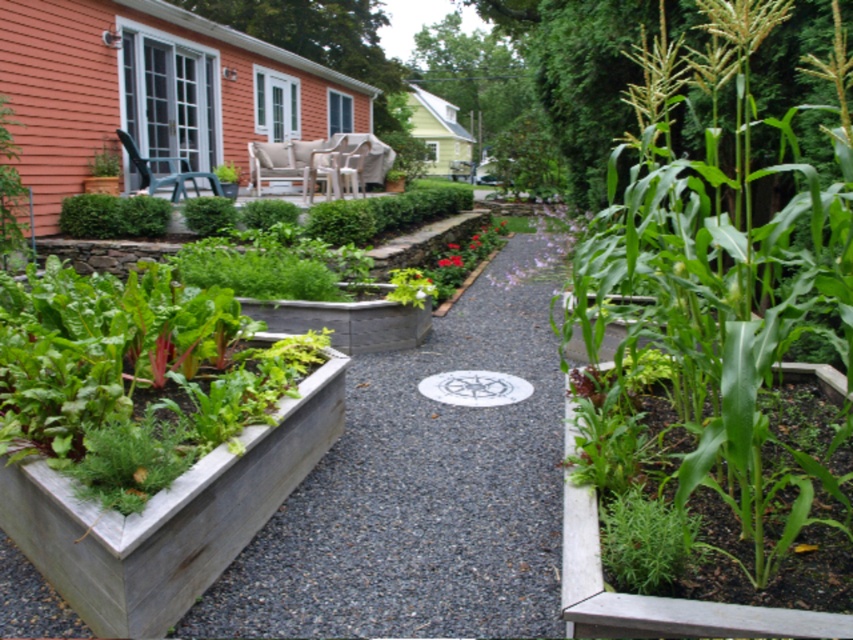
Question: Is smooth gray planter at lower left bigger than green leafy plant at center?

Choices:
 (A) no
 (B) yes

Answer: (B)

Question: Does smooth gray planter at lower left appear over green leafy plant at center?

Choices:
 (A) yes
 (B) no

Answer: (A)

Question: Which object is closer to the camera taking this photo?

Choices:
 (A) green leafy plant at center
 (B) smooth gray planter at lower left

Answer: (A)

Question: Is smooth gray planter at lower left further to camera compared to green leafy plant at center?

Choices:
 (A) no
 (B) yes

Answer: (B)